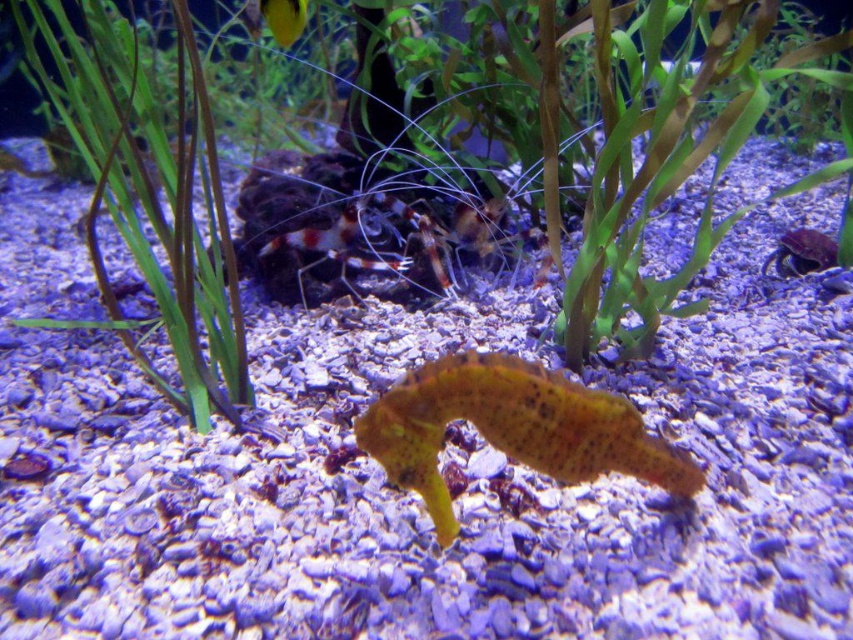
Question: Which point is farther from the camera taking this photo?

Choices:
 (A) (283, 24)
 (B) (28, 36)
 (C) (650, 196)
 (D) (590, 419)

Answer: (A)

Question: Can you confirm if yellow textured seahorse at center is positioned below smooth purple crab at right?

Choices:
 (A) no
 (B) yes

Answer: (B)

Question: From the image, what is the correct spatial relationship of green leafy plant at center in relation to green matte plant at left?

Choices:
 (A) above
 (B) below

Answer: (B)

Question: Which point appears closest to the camera in this image?

Choices:
 (A) (775, 259)
 (B) (112, 83)
 (C) (293, 38)
 (D) (126, 186)

Answer: (C)

Question: Is yellow textured seahorse at center below shiny yellow fish at upper center?

Choices:
 (A) yes
 (B) no

Answer: (A)

Question: Which object appears farthest from the camera in this image?

Choices:
 (A) shiny yellow fish at upper center
 (B) green matte plant at left

Answer: (A)